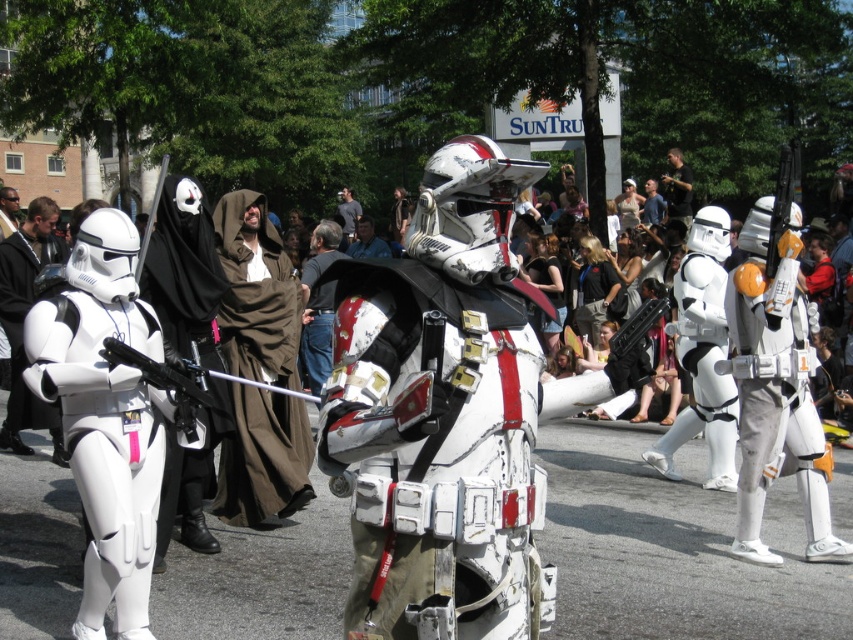
You are a photographer at the event and want to capture both the brown fabric robe at center and the dark gray fabric shirt at center in a single photo. Since you can only focus on one subject at a time, which one should you focus on to ensure the other is still in the background?

You should focus on the brown fabric robe at center because it is in front of the dark gray fabric shirt at center, so focusing on the foreground subject will keep the background in better focus.

You are a photographer at the event and want to capture both the white matte stormtrooper armor at left and the matte black helmet at upper left in a single shot. Based on their positions, which object should you focus on first to ensure both are in frame?

The white matte stormtrooper armor at left is located below the matte black helmet at upper left. To capture both in a single shot, focus on the matte black helmet at upper left first as it is higher up, allowing the camera to include the lower positioned stormtrooper armor below it.

You are a photographer at the event and want to capture the brown fabric robe at center in your shot. Where should you position yourself relative to the point marked at coordinates [256,292] to ensure it is centered in your frame?

Position yourself directly at the point marked at coordinates [256,292] since the brown fabric robe at center is located exactly at that point.